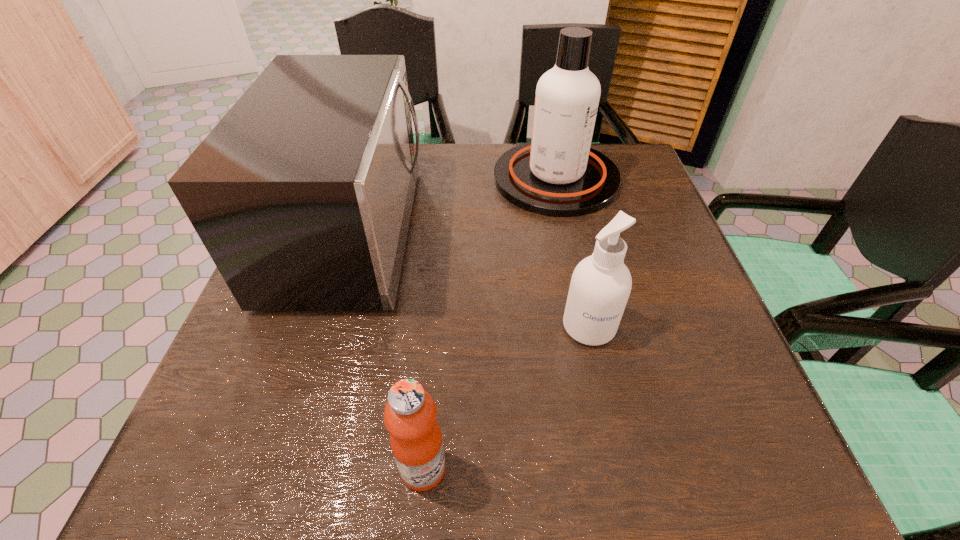
Locate an element on the screen. This screenshot has width=960, height=540. free spot between the taller cleansing agent and the leftmost object is located at coordinates (454, 205).

Where is `empty space between the microwave oven and the nearer cleansing agent`? This screenshot has width=960, height=540. empty space between the microwave oven and the nearer cleansing agent is located at coordinates (470, 279).

Find the location of a particular element. The width and height of the screenshot is (960, 540). vacant area between the nearer cleansing agent and the farther cleansing agent is located at coordinates (572, 253).

Select which object is the third closest to the second tallest object. Please provide its 2D coordinates. Your answer should be formatted as a tuple, i.e. [(x, y)], where the tuple contains the x and y coordinates of a point satisfying the conditions above.

[(600, 286)]

Locate which object ranks third in proximity to the taller cleansing agent. Please provide its 2D coordinates. Your answer should be formatted as a tuple, i.e. [(x, y)], where the tuple contains the x and y coordinates of a point satisfying the conditions above.

[(410, 414)]

At what (x,y) coordinates should I click in order to perform the action: click on free space that satisfies the following two spatial constraints: 1. on the front label of the nearer cleansing agent; 2. on the front label of the shortest object. Please return your answer as a coordinate pair (x, y). The width and height of the screenshot is (960, 540). Looking at the image, I should click on (619, 468).

Where is `vacant space that satisfies the following two spatial constraints: 1. on the front side of the tallest object; 2. with the door open on the leftmost object`? The width and height of the screenshot is (960, 540). vacant space that satisfies the following two spatial constraints: 1. on the front side of the tallest object; 2. with the door open on the leftmost object is located at coordinates (567, 231).

I want to click on free spot that satisfies the following two spatial constraints: 1. on the front label of the nearer cleansing agent; 2. on the front label of the second object from left to right, so click(619, 468).